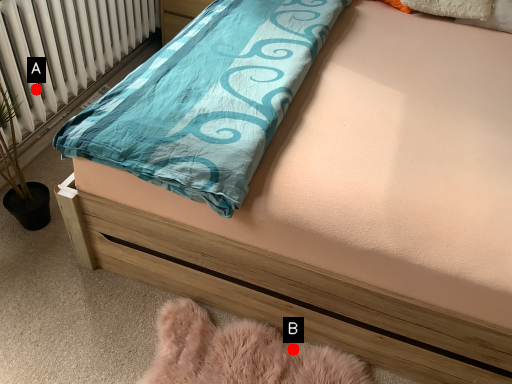
Question: Two points are circled on the image, labeled by A and B beside each circle. Which point is further to the camera?

Choices:
 (A) A is further
 (B) B is further

Answer: (A)